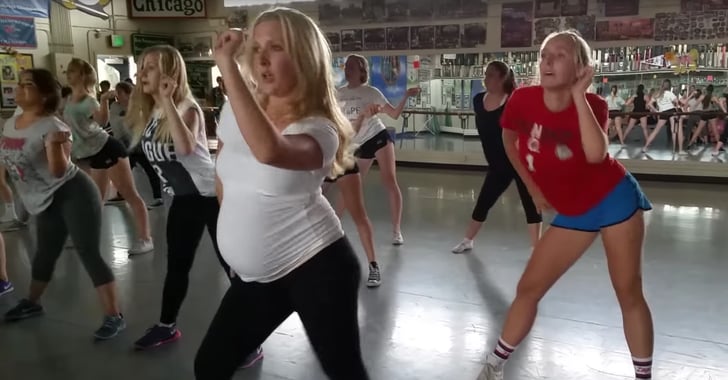
Where is `floor`? Image resolution: width=728 pixels, height=380 pixels. floor is located at coordinates (442, 331).